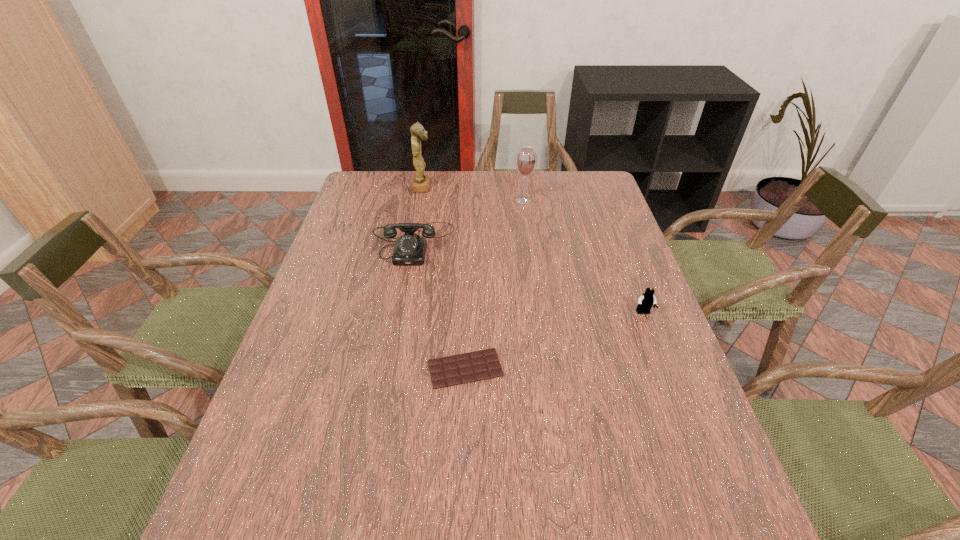
The height and width of the screenshot is (540, 960). Identify the location of free spot that satisfies the following two spatial constraints: 1. on the front-facing side of the chocolate bar; 2. on the right side of the telephone. (392, 368).